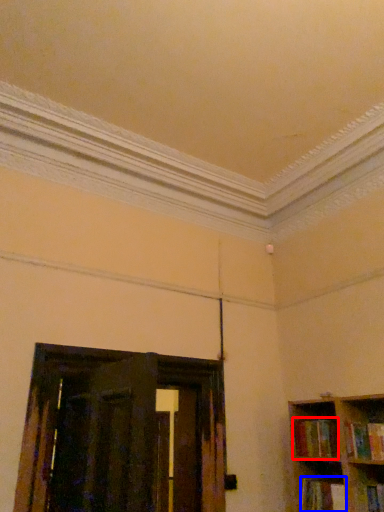
Question: Which object is further to the camera taking this photo, book (highlighted by a red box) or book (highlighted by a blue box)?

Choices:
 (A) book
 (B) book

Answer: (A)